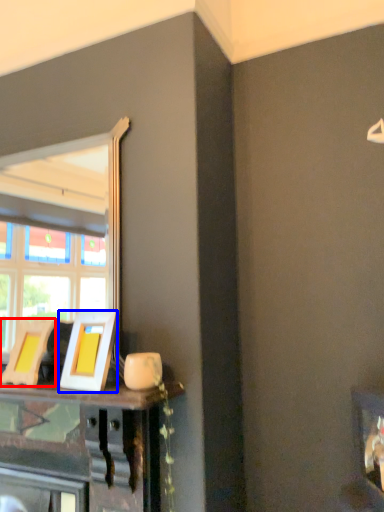
Question: Among these objects, which one is farthest to the camera, picture frame (highlighted by a red box) or picture frame (highlighted by a blue box)?

Choices:
 (A) picture frame
 (B) picture frame

Answer: (A)